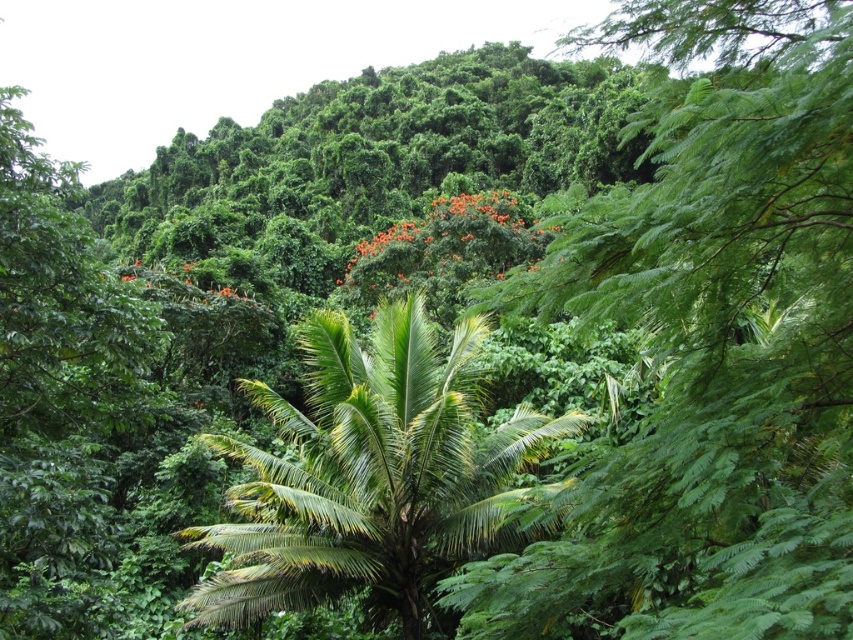
Question: Is green leafy palm at center above orange bloom at center?

Choices:
 (A) yes
 (B) no

Answer: (B)

Question: Does green leafy palm at center have a smaller size compared to orange bloom at center?

Choices:
 (A) no
 (B) yes

Answer: (B)

Question: Which object is closer to the camera taking this photo?

Choices:
 (A) orange bloom at center
 (B) green leafy palm at center

Answer: (B)

Question: Does green leafy palm at center appear over orange bloom at center?

Choices:
 (A) no
 (B) yes

Answer: (A)

Question: Among these points, which one is nearest to the camera?

Choices:
 (A) (354, 259)
 (B) (404, 582)

Answer: (B)